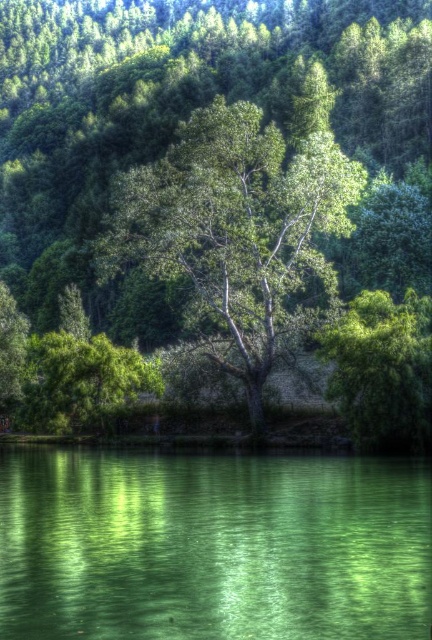
Question: Which point is closer to the camera taking this photo?

Choices:
 (A) (57, 509)
 (B) (387, 381)

Answer: (A)

Question: Does green reflective water at center have a lesser width compared to green leafy tree at center?

Choices:
 (A) no
 (B) yes

Answer: (B)

Question: Which of the following is the closest to the observer?

Choices:
 (A) (378, 337)
 (B) (38, 512)
 (C) (279, 234)

Answer: (B)

Question: In this image, where is green reflective water at center located relative to green leafy tree at right?

Choices:
 (A) right
 (B) left

Answer: (B)

Question: Is green reflective water at center positioned before green leafy tree at right?

Choices:
 (A) yes
 (B) no

Answer: (A)

Question: Based on their relative distances, which object is farther from the green leafy tree at right?

Choices:
 (A) green leafy tree at center
 (B) green reflective water at center

Answer: (A)